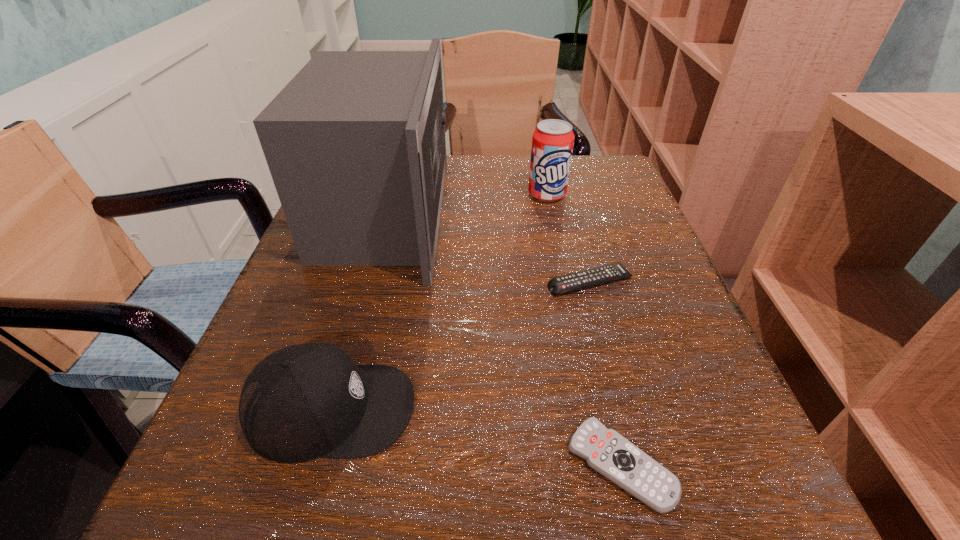
At what (x,y) coordinates should I click in order to perform the action: click on free location located on the left of the shortest object. Please return your answer as a coordinate pair (x, y). Looking at the image, I should click on (314, 464).

Where is `microwave oven positioned at the far edge`? microwave oven positioned at the far edge is located at coordinates (355, 143).

The width and height of the screenshot is (960, 540). I want to click on soda can that is positioned at the far edge, so click(552, 142).

Locate an element on the screen. The image size is (960, 540). cap that is positioned at the near edge is located at coordinates (305, 401).

The height and width of the screenshot is (540, 960). What are the coordinates of `remote control that is at the near edge` in the screenshot? It's located at (606, 451).

At what (x,y) coordinates should I click in order to perform the action: click on microwave oven located at the left edge. Please return your answer as a coordinate pair (x, y). The width and height of the screenshot is (960, 540). Looking at the image, I should click on (355, 143).

Where is `cap situated at the left edge`? This screenshot has height=540, width=960. cap situated at the left edge is located at coordinates [305, 401].

Where is `soda can present at the right edge`? soda can present at the right edge is located at coordinates (552, 142).

What are the coordinates of `object at the far left corner` in the screenshot? It's located at (355, 143).

Find the location of a particular element. Image resolution: width=960 pixels, height=540 pixels. object at the near left corner is located at coordinates (305, 401).